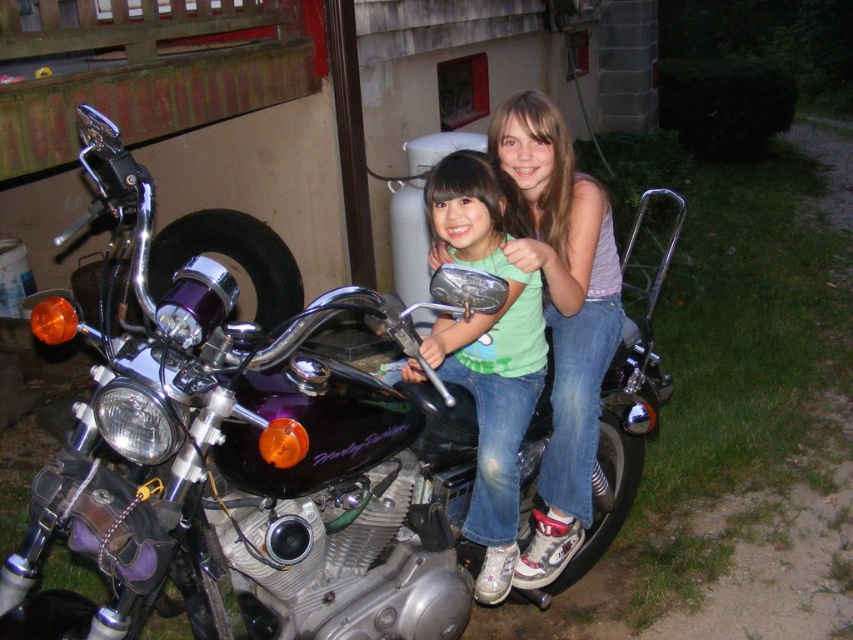
You are a photographer trying to capture the shiny purple motorcycle at center and the denim jeans at center in a single shot. Based on their positions, which object should you focus on first to ensure both are in frame?

The shiny purple motorcycle at center is below denim jeans at center, so you should focus on the denim jeans at center first to ensure both are in frame.

You are a photographer trying to capture a clear photo of the shiny purple motorcycle at center and the green matte shirt at center. Since the motorcycle is below the shirt, where should you position your camera to ensure both are in frame?

Since the shiny purple motorcycle at center is located below the green matte shirt at center, you should position your camera slightly above the green matte shirt at center to capture both objects in the frame.